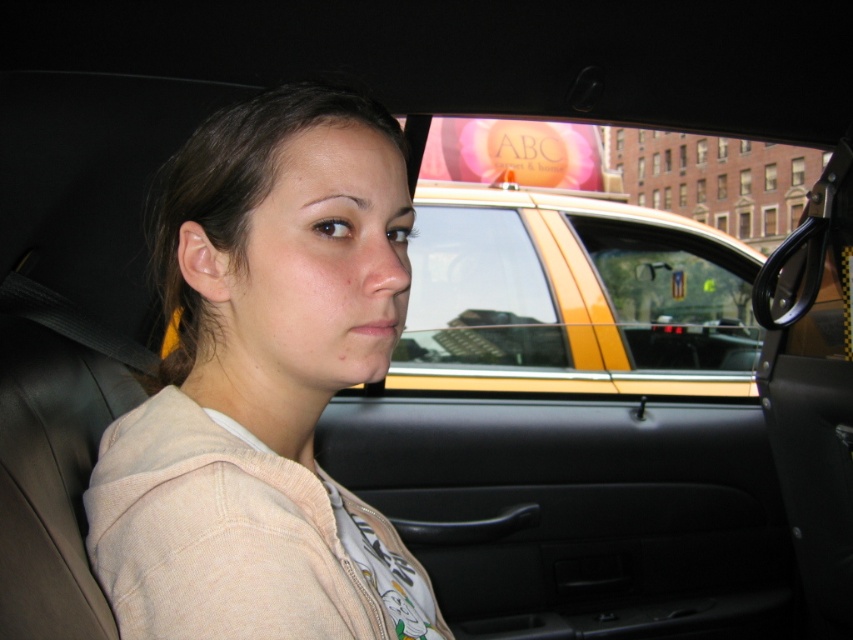
Is light beige hoodie at center below yellow plastic taxi at center?

Correct, light beige hoodie at center is located below yellow plastic taxi at center.

Is the position of light beige hoodie at center less distant than that of yellow plastic taxi at center?

Yes.

Which is in front, point (312, 304) or point (740, 365)?

Point (312, 304) is in front.

I want to click on light beige hoodie at center, so pyautogui.click(x=264, y=385).